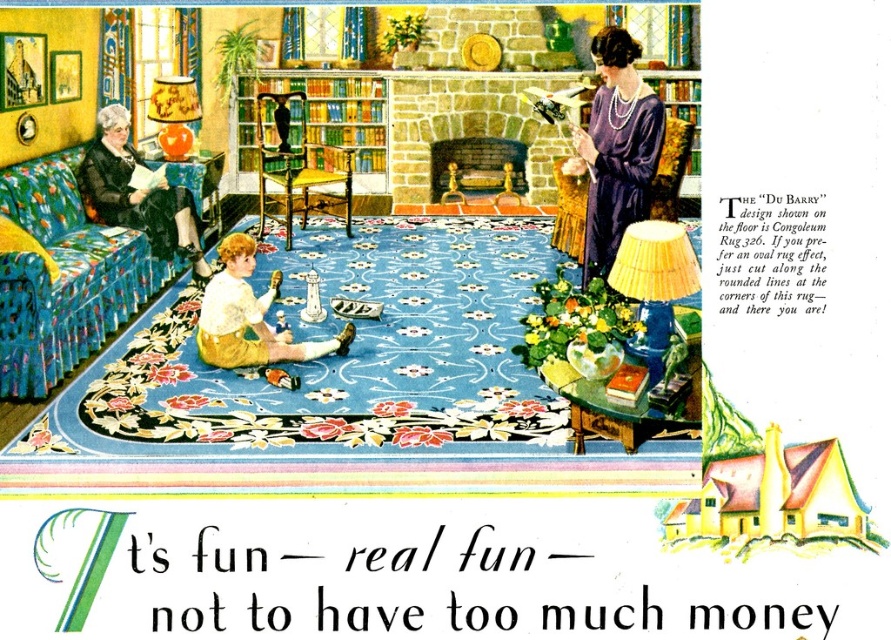
Question: Which point is farther to the camera?

Choices:
 (A) (127, 259)
 (B) (674, 257)
 (C) (349, 99)
 (D) (170, 144)

Answer: (C)

Question: Is yellow painted wood house at center positioned at the back of yellow cotton dress at center?

Choices:
 (A) no
 (B) yes

Answer: (A)

Question: Which object is the farthest from the matte black dress at left?

Choices:
 (A) orange fabric lampshade at upper left
 (B) green glossy bookshelf at center
 (C) yellow pleated lampshade at upper right

Answer: (C)

Question: Is green glossy bookshelf at center further to camera compared to yellow cotton dress at center?

Choices:
 (A) yes
 (B) no

Answer: (A)

Question: Considering the relative positions of green glossy bookshelf at center and matte black dress at left in the image provided, where is green glossy bookshelf at center located with respect to matte black dress at left?

Choices:
 (A) above
 (B) below

Answer: (A)

Question: Which point is closer to the camera?

Choices:
 (A) (344, 339)
 (B) (736, 554)
 (C) (198, 257)
 (D) (123, 257)

Answer: (B)